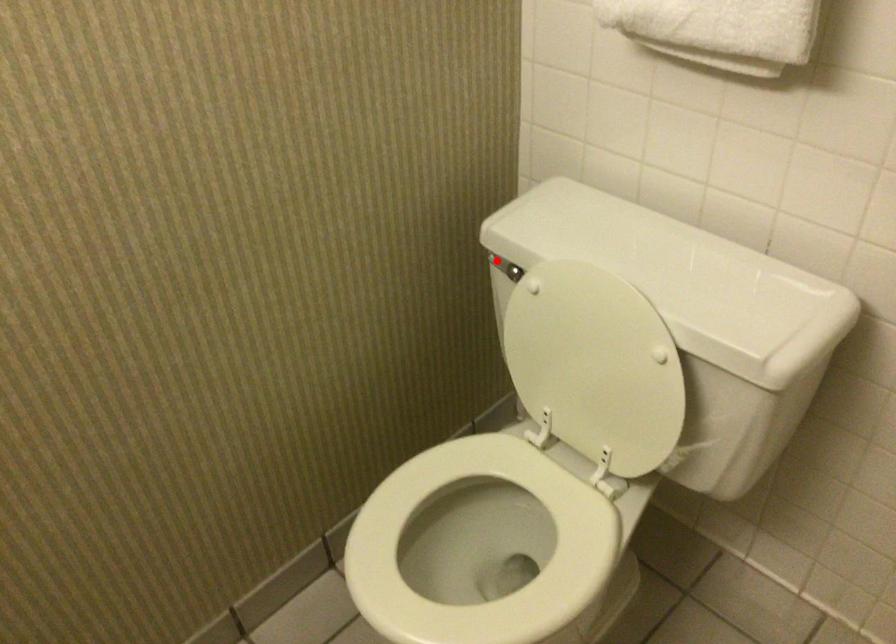
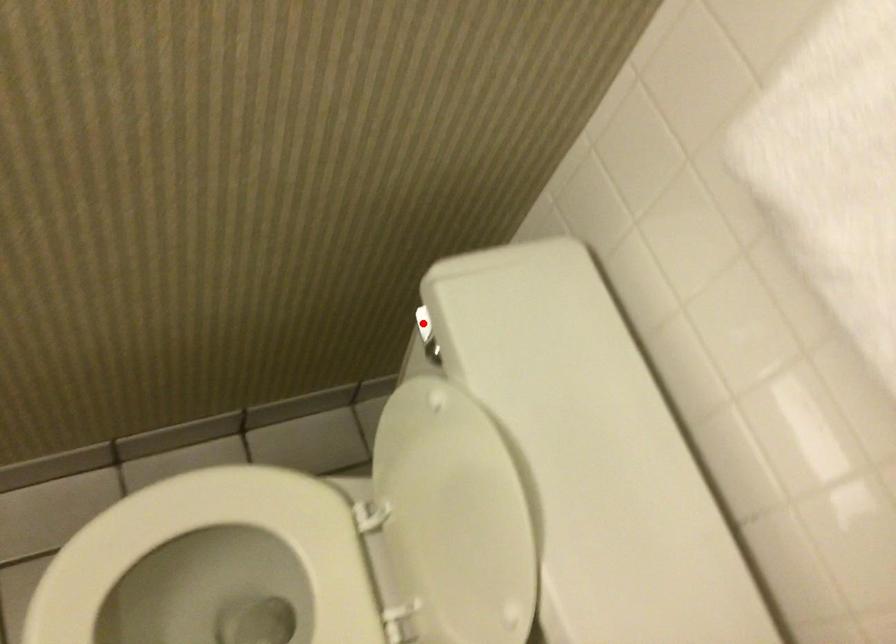
I am providing you with two images of the same scene from different viewpoints. A red point is marked on the first image and another point is marked on the second image. Does the point marked in image1 correspond to the same location as the one in image2?

Yes